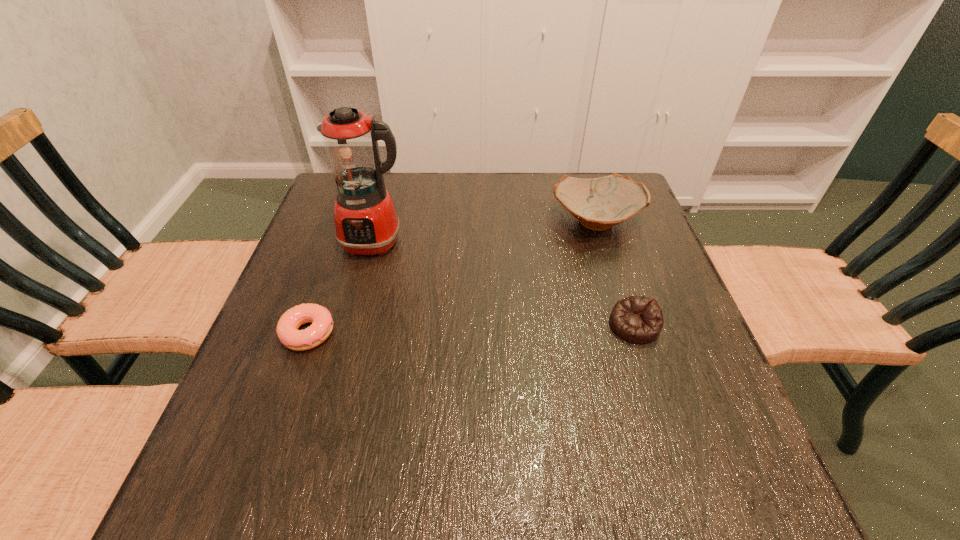
Identify the location of vacant area between the doughnut and the tallest object. (342, 287).

Locate an element on the screen. Image resolution: width=960 pixels, height=540 pixels. free area in between the doughnut and the food processor is located at coordinates (342, 287).

Identify the location of empty space between the doughnut and the food processor. Image resolution: width=960 pixels, height=540 pixels. (342, 287).

Identify the location of free space between the food processor and the pottery. Image resolution: width=960 pixels, height=540 pixels. (485, 232).

You are a GUI agent. You are given a task and a screenshot of the screen. Output one action in this format:
    pyautogui.click(x=<x>, y=<y>)
    Task: Click on the free space between the tallest object and the doughnut
    This screenshot has width=960, height=540.
    Given the screenshot: What is the action you would take?
    pyautogui.click(x=342, y=287)

You are a GUI agent. You are given a task and a screenshot of the screen. Output one action in this format:
    pyautogui.click(x=<x>, y=<y>)
    Task: Click on the empty space that is in between the food processor and the doughnut
    The height and width of the screenshot is (540, 960).
    Given the screenshot: What is the action you would take?
    pyautogui.click(x=342, y=287)

Find the location of a particular element. The height and width of the screenshot is (540, 960). vacant area that lies between the third shortest object and the doughnut is located at coordinates (452, 277).

I want to click on free space between the second tallest object and the food processor, so click(x=485, y=232).

Select which object appears as the third closest to the doughnut. Please provide its 2D coordinates. Your answer should be formatted as a tuple, i.e. [(x, y)], where the tuple contains the x and y coordinates of a point satisfying the conditions above.

[(638, 319)]

Where is `object identified as the third closest to the food processor`? object identified as the third closest to the food processor is located at coordinates (638, 319).